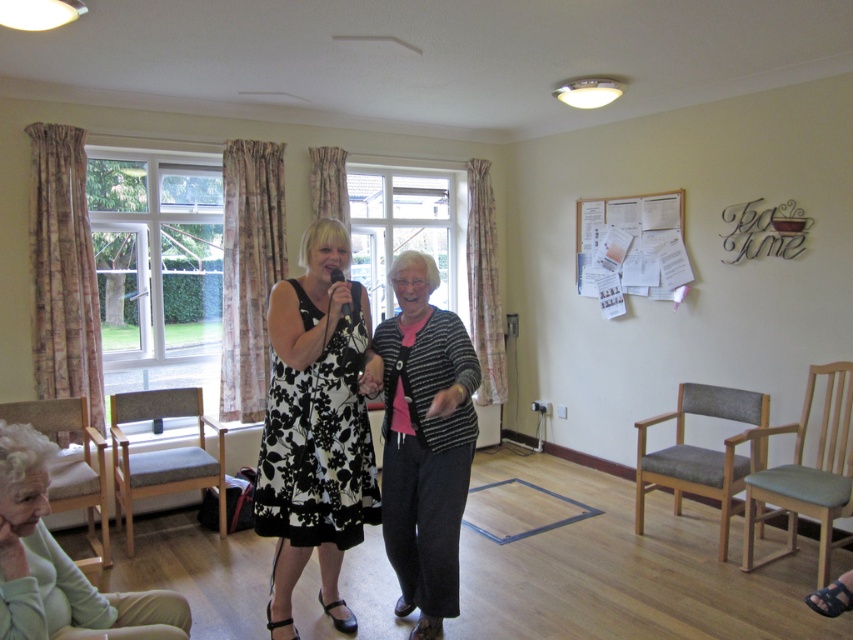
Is light green fabric chair at lower left bigger than light beige fabric armchair at lower left?

Result: No, light green fabric chair at lower left is not bigger than light beige fabric armchair at lower left.

Which is in front, point (74, 595) or point (103, 506)?

Point (74, 595) is in front.

Identify the location of light green fabric chair at lower left. click(61, 564).

Describe the element at coordinates (61, 564) in the screenshot. The height and width of the screenshot is (640, 853). I see `light green fabric chair at lower left` at that location.

Between light green fabric chair at lower left and light gray fabric armchair at right, which one is positioned higher?

Positioned higher is light green fabric chair at lower left.

Is point (55, 627) positioned behind point (793, 461)?

That is False.

Image resolution: width=853 pixels, height=640 pixels. I want to click on light green fabric chair at lower left, so 61,564.

Is point (421, 532) less distant than point (368, 484)?

That is True.

The width and height of the screenshot is (853, 640). What do you see at coordinates (424, 442) in the screenshot?
I see `striped sweater at center` at bounding box center [424, 442].

Locate an element on the screen. The width and height of the screenshot is (853, 640). striped sweater at center is located at coordinates (424, 442).